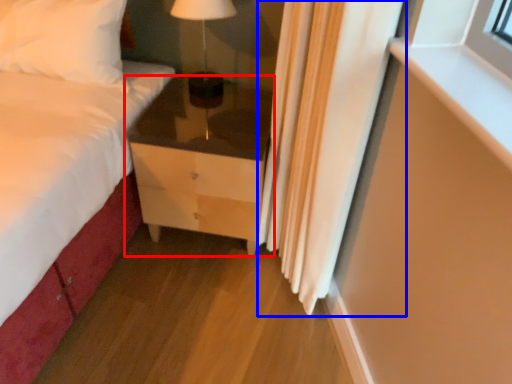
Question: Which object appears farthest to the camera in this image, chest of drawers (highlighted by a red box) or curtain (highlighted by a blue box)?

Choices:
 (A) chest of drawers
 (B) curtain

Answer: (A)